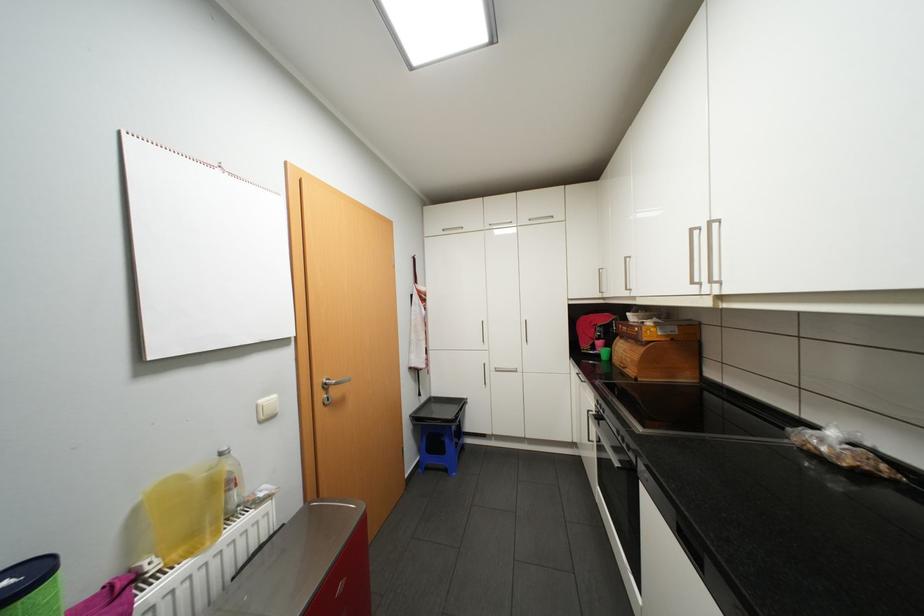
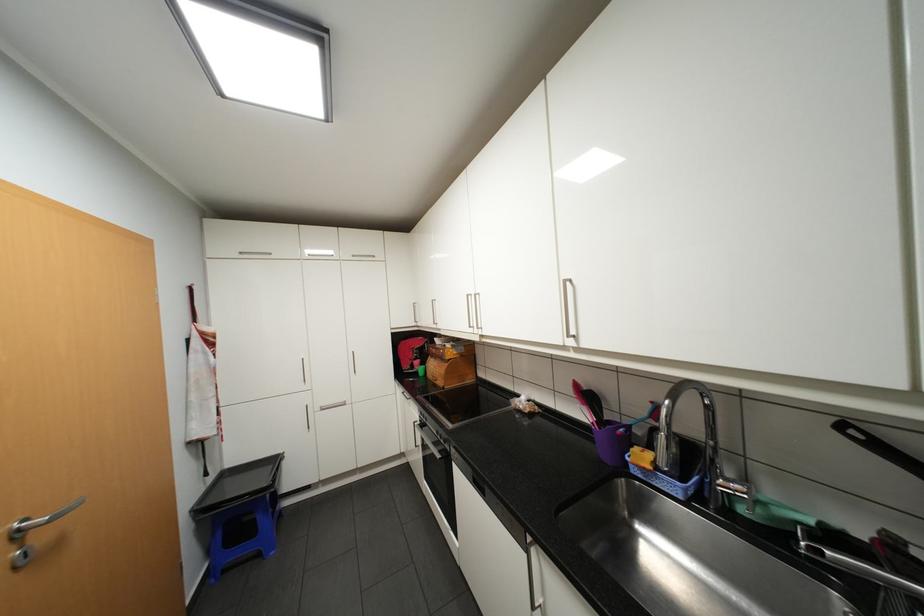
The point at (334, 383) is marked in the first image. Where is the corresponding point in the second image?

(27, 530)